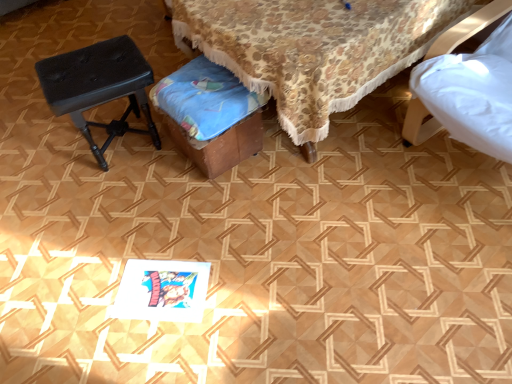
Locate an element on the screen. Image resolution: width=512 pixels, height=384 pixels. free point above wooden music stool at center (from a real-world perspective) is located at coordinates (203, 84).